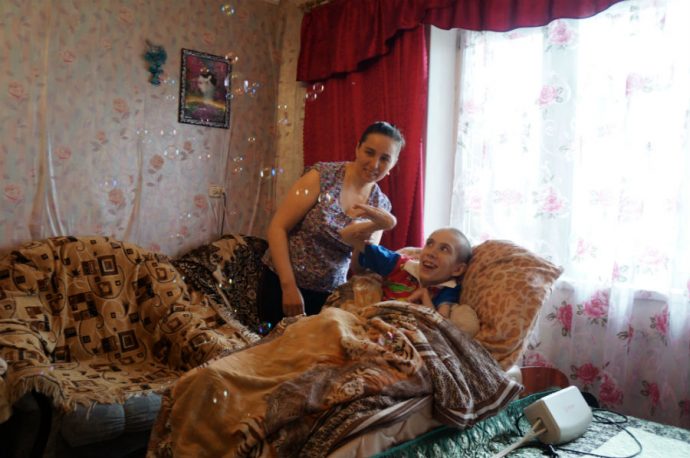
Find the location of a particular element. The width and height of the screenshot is (690, 458). chair is located at coordinates (141, 403), (228, 276).